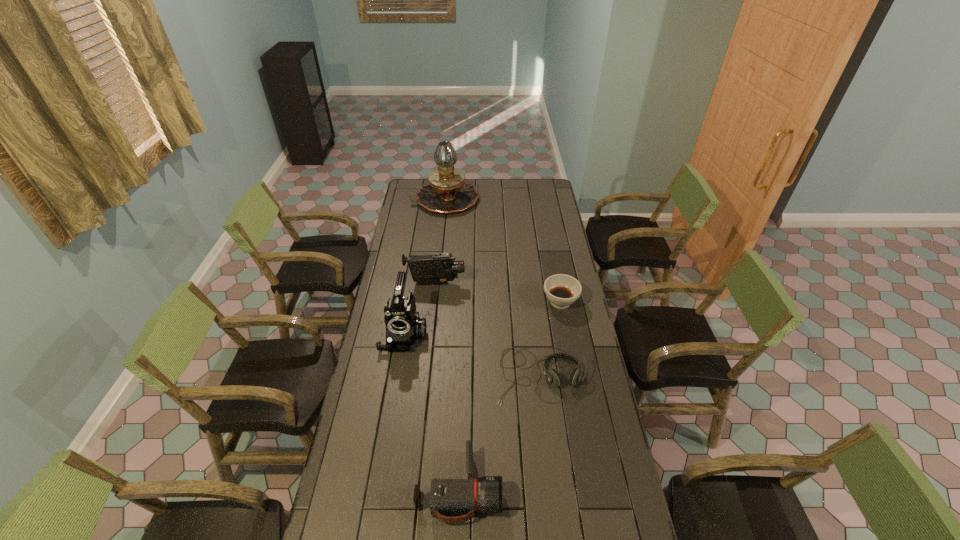
Locate an element on the screen. vacant space that satisfies the following two spatial constraints: 1. on the front side of the soup bowl; 2. on the right side of the farthest object is located at coordinates (434, 302).

Find the location of a particular element. Image resolution: width=960 pixels, height=540 pixels. vacant area that satisfies the following two spatial constraints: 1. on the front-facing side of the farthest camcorder; 2. on the lens mount of the tallest camcorder is located at coordinates (430, 334).

Identify the location of vacant area that satisfies the following two spatial constraints: 1. on the front-facing side of the soup bowl; 2. on the right side of the farthest camcorder. point(433,302).

Where is `free space that satisfies the following two spatial constraints: 1. on the front-facing side of the farthest camcorder; 2. on the right side of the soup bowl`? This screenshot has width=960, height=540. free space that satisfies the following two spatial constraints: 1. on the front-facing side of the farthest camcorder; 2. on the right side of the soup bowl is located at coordinates (433, 302).

Find the location of `free location that satisfies the following two spatial constraints: 1. on the front-facing side of the soup bowl; 2. on the left side of the third tallest object`. free location that satisfies the following two spatial constraints: 1. on the front-facing side of the soup bowl; 2. on the left side of the third tallest object is located at coordinates tap(433, 302).